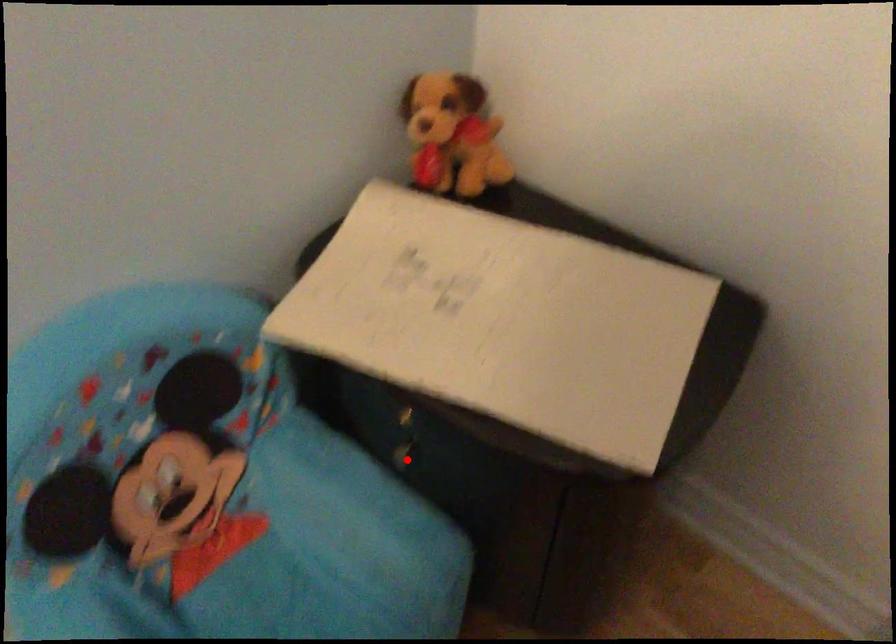
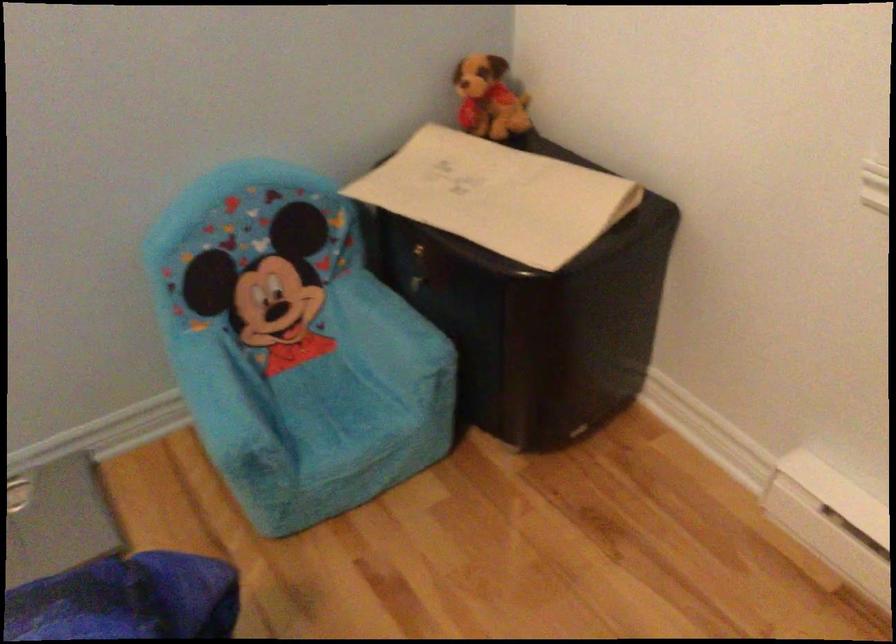
Question: A red point is marked in image1. In image2, is the corresponding 3D point closer to the camera or farther? Reply with the corresponding letter.

Choices:
 (A) The corresponding 3D point is closer.
 (B) The corresponding 3D point is farther.

Answer: (B)